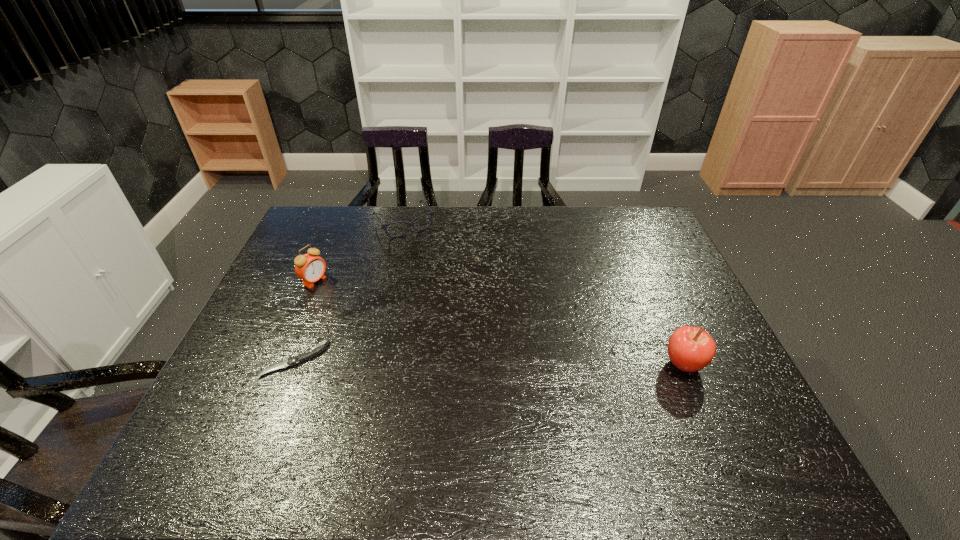
Where is `unoccupied position between the shortest object and the apple`? unoccupied position between the shortest object and the apple is located at coordinates (490, 362).

Where is `free space between the rightmost object and the shortest object`? free space between the rightmost object and the shortest object is located at coordinates click(x=490, y=362).

Locate an element on the screen. This screenshot has height=540, width=960. free area in between the rightmost object and the farthest object is located at coordinates (544, 294).

Where is `free space that is in between the pocketknife and the second object from right to left`? free space that is in between the pocketknife and the second object from right to left is located at coordinates (349, 291).

Locate an element on the screen. object that ranks as the closest to the farthest object is located at coordinates (310, 268).

The height and width of the screenshot is (540, 960). Find the location of `object identified as the third closest to the pocketknife`. object identified as the third closest to the pocketknife is located at coordinates (690, 349).

I want to click on free space that satisfies the following two spatial constraints: 1. on the front side of the apple; 2. on the left side of the shortest object, so tap(293, 364).

What are the coordinates of `vacant position in the image that satisfies the following two spatial constraints: 1. on the back side of the spectacles; 2. on the left side of the pocketknife` in the screenshot? It's located at (348, 223).